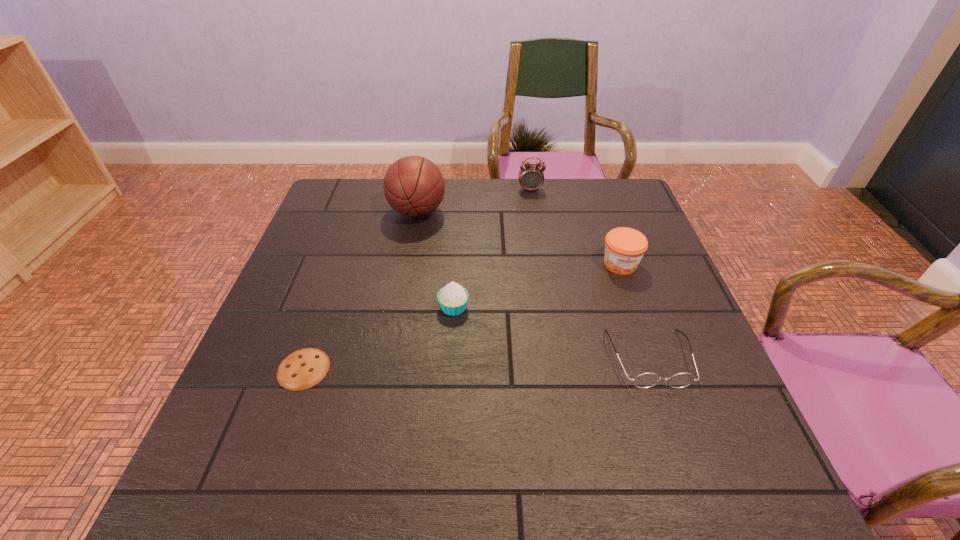
The image size is (960, 540). Find the location of `spectacles located at the right edge`. spectacles located at the right edge is located at coordinates (645, 380).

Locate an element on the screen. Image resolution: width=960 pixels, height=540 pixels. vacant space at the near edge is located at coordinates (352, 480).

Where is `vacant region at the left edge of the desktop`? The height and width of the screenshot is (540, 960). vacant region at the left edge of the desktop is located at coordinates 311,226.

Where is `blank area at the right edge`? blank area at the right edge is located at coordinates (645, 323).

At what (x,y) coordinates should I click in order to perform the action: click on free space at the far left corner. Please return your answer as a coordinate pair (x, y). The width and height of the screenshot is (960, 540). Looking at the image, I should click on [350, 188].

I want to click on vacant space at the far right corner of the desktop, so click(601, 186).

Locate an element on the screen. vacant space at the near right corner of the desktop is located at coordinates (675, 456).

Where is `free space between the third nearest object and the basketball`? This screenshot has height=540, width=960. free space between the third nearest object and the basketball is located at coordinates (436, 260).

You are a GUI agent. You are given a task and a screenshot of the screen. Output one action in this format:
    pyautogui.click(x=<x>, y=<y>)
    Task: Click on the empty space between the jam and the fourth object from right to left
    
    Given the screenshot: What is the action you would take?
    pyautogui.click(x=537, y=286)

Find the location of `free space between the fifth tallest object and the third farthest object`. free space between the fifth tallest object and the third farthest object is located at coordinates click(x=636, y=311).